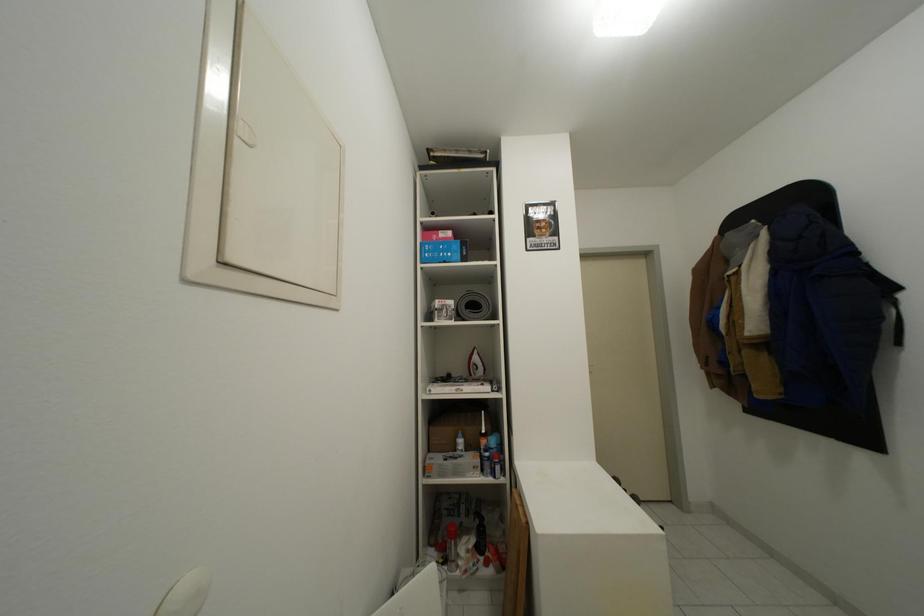
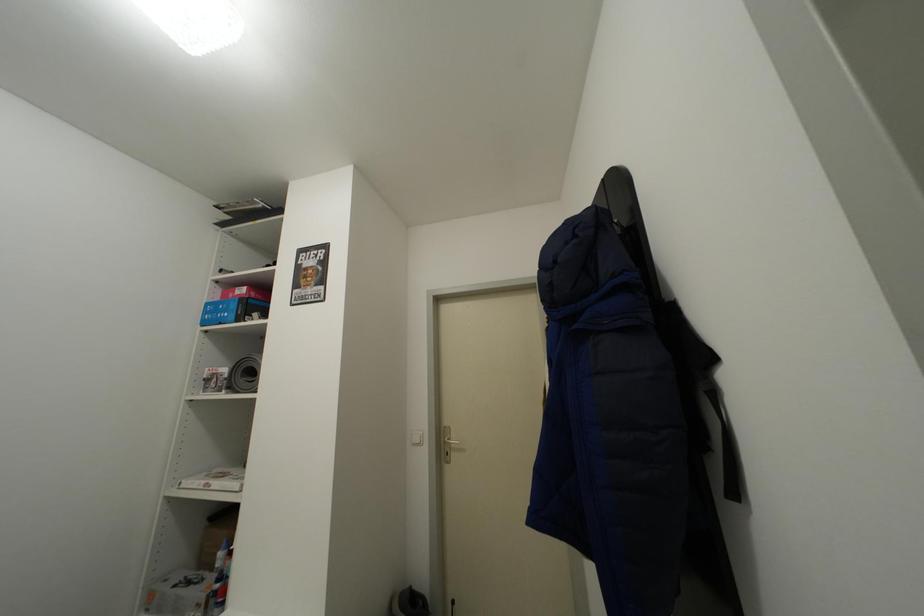
Question: In a continuous first-person perspective shot, in which direction is the camera moving?

Choices:
 (A) Left
 (B) Right
 (C) Forward
 (D) Backward

Answer: (B)